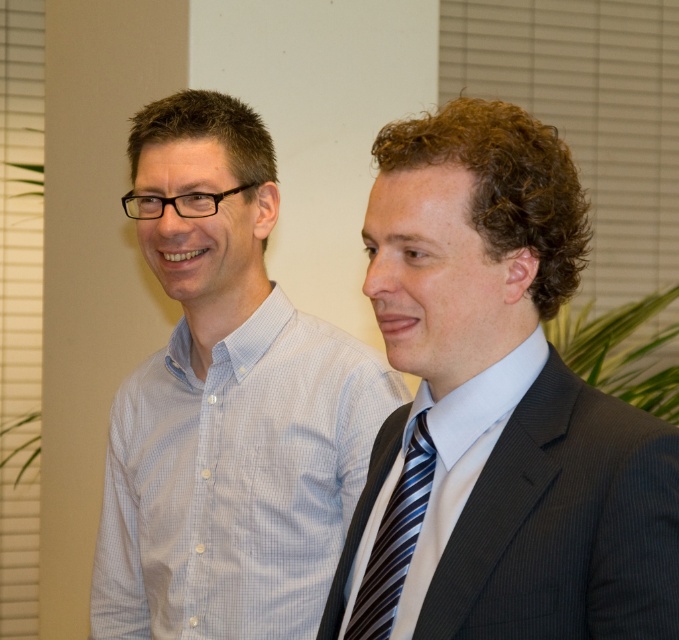
You are a photographer trying to capture a closeup of the point at coordinates point (598, 554). Your camera has a focal length of 50mm and a sensor size of 24mm x 36mm. What is the minimum distance you should position your camera from the point to ensure it fits entirely within the frame?

The point at coordinates point (598, 554) is 36.20 inches from the camera. To ensure it fits within the frame, the camera should be positioned at least 36.20 inches away from the point.

You are organizing a charity event and need to ensure all donated shirts fit properly. You have a white checkered shirt at left and a light blue woven shirt at right. Which shirt has a larger size?

The white checkered shirt at left has a larger size compared to the light blue woven shirt at right.